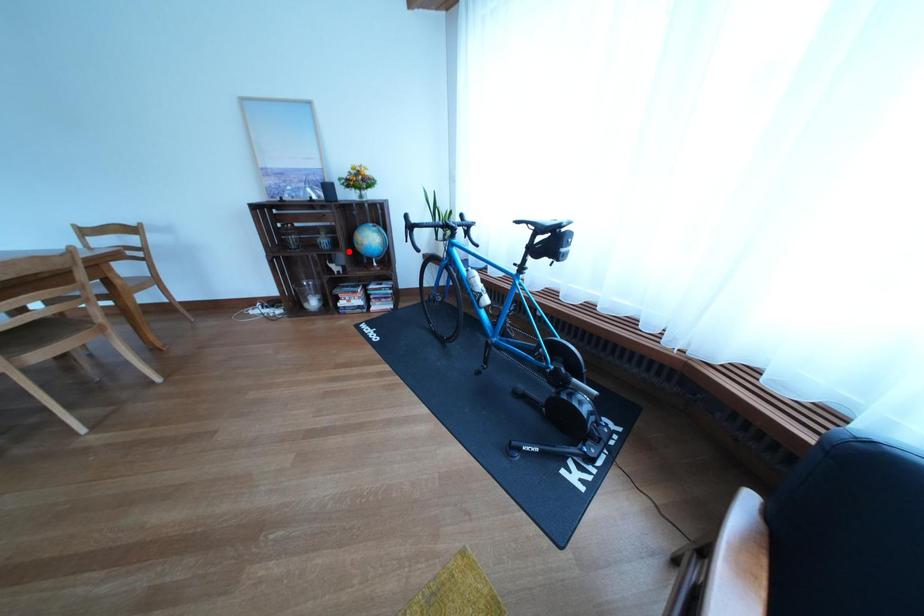
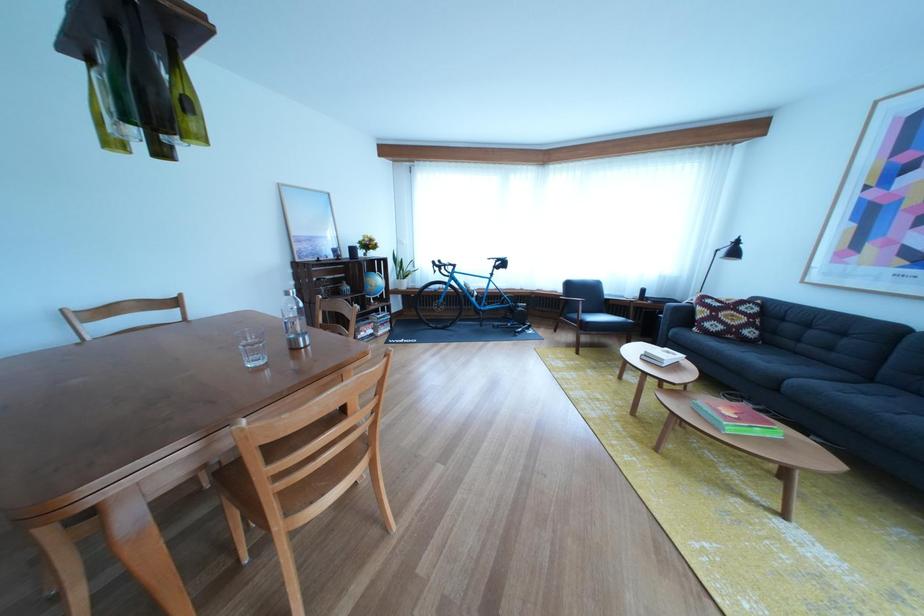
Locate, in the second image, the point that corresponds to the highlighted location in the first image.

(367, 297)